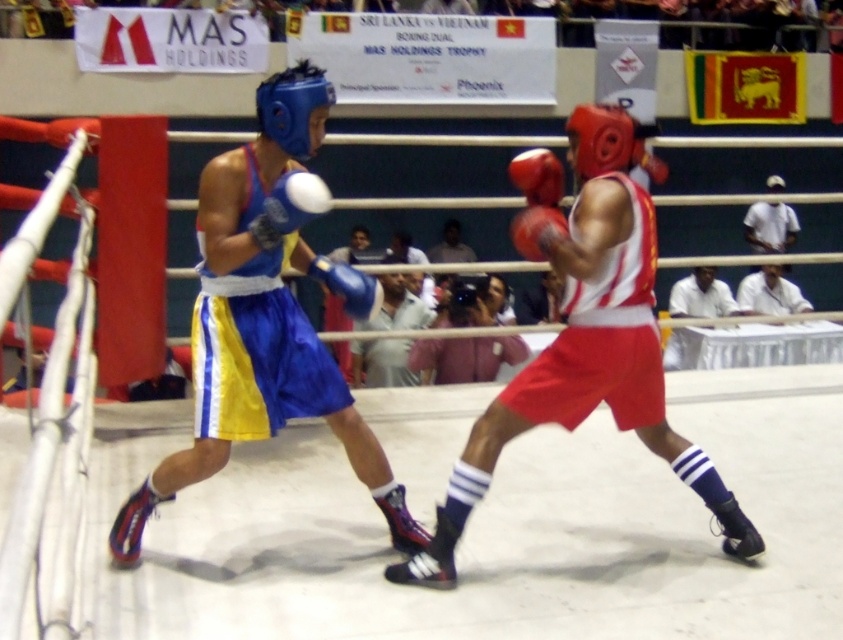
Question: Does shiny blue boxing glove at center have a smaller size compared to matte red boxing glove at center?

Choices:
 (A) no
 (B) yes

Answer: (B)

Question: Among these points, which one is nearest to the camera?

Choices:
 (A) (213, 173)
 (B) (556, 227)
 (C) (635, 252)
 (D) (782, 237)

Answer: (B)

Question: Does blue synthetic boxing glove at upper center come behind blue leather boxing glove at center?

Choices:
 (A) no
 (B) yes

Answer: (A)

Question: Which object is farther from the camera taking this photo?

Choices:
 (A) matte blue boxing glove at center
 (B) matte red boxing glove at center
 (C) blue leather boxing glove at center

Answer: (A)

Question: Does white fabric shirt at upper right have a larger size compared to matte blue boxing glove at center?

Choices:
 (A) no
 (B) yes

Answer: (B)

Question: Considering the real-world distances, which object is closest to the shiny blue boxing glove at center?

Choices:
 (A) white fabric shirt at upper center
 (B) matte red boxing glove at center
 (C) white cotton shirt at upper right
 (D) blue synthetic boxing glove at upper center

Answer: (D)